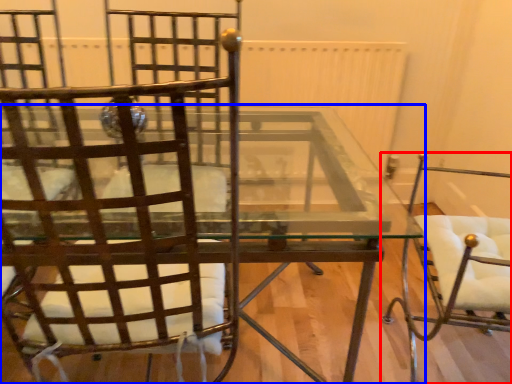
Question: Which object is closer to the camera taking this photo, chair (highlighted by a red box) or table (highlighted by a blue box)?

Choices:
 (A) chair
 (B) table

Answer: (A)